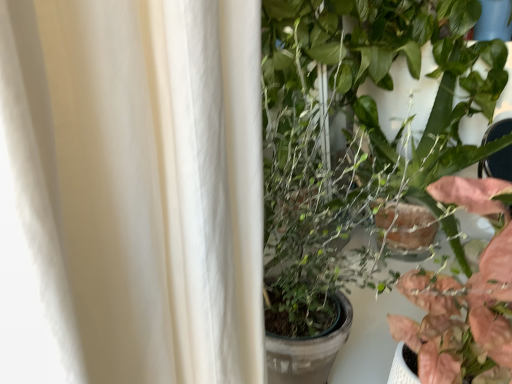
Question: Is green glossy plant at center, arranged as the 1th houseplant when viewed from the top, inside or outside of pink matte leafy plant at right, positioned as the 1th houseplant in bottom-to-top order?

Choices:
 (A) outside
 (B) inside

Answer: (A)

Question: Does point (375, 72) appear closer or farther from the camera than point (505, 226)?

Choices:
 (A) farther
 (B) closer

Answer: (A)

Question: In terms of height, does green glossy plant at center, positioned as the 2th houseplant in bottom-to-top order, look taller or shorter compared to pink matte leafy plant at right, positioned as the second houseplant in top-to-bottom order?

Choices:
 (A) tall
 (B) short

Answer: (A)

Question: Is pink matte leafy plant at right, positioned as the second houseplant in top-to-bottom order, spatially inside green glossy plant at center, arranged as the 1th houseplant when viewed from the top, or outside of it?

Choices:
 (A) outside
 (B) inside

Answer: (A)

Question: From a real-world perspective, is pink matte leafy plant at right, positioned as the 1th houseplant in bottom-to-top order, positioned above or below green glossy plant at center, positioned as the 2th houseplant in bottom-to-top order?

Choices:
 (A) below
 (B) above

Answer: (A)

Question: Considering their positions, is pink matte leafy plant at right, positioned as the second houseplant in top-to-bottom order, located in front of or behind green glossy plant at center, arranged as the 1th houseplant when viewed from the top?

Choices:
 (A) behind
 (B) front

Answer: (B)

Question: Does point (461, 334) appear closer or farther from the camera than point (304, 107)?

Choices:
 (A) farther
 (B) closer

Answer: (B)